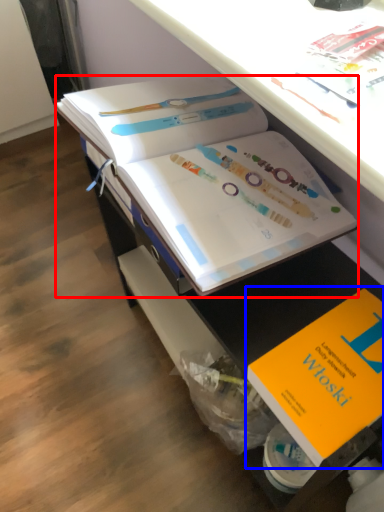
Question: Which point is further to the camera, book (highlighted by a red box) or book (highlighted by a blue box)?

Choices:
 (A) book
 (B) book

Answer: (A)